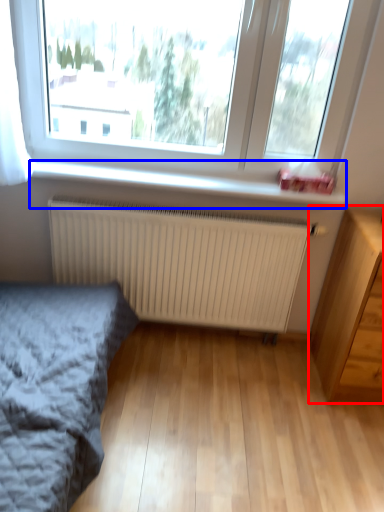
Question: Which of the following is the closest to the observer, chest of drawers (highlighted by a red box) or window sill (highlighted by a blue box)?

Choices:
 (A) chest of drawers
 (B) window sill

Answer: (A)